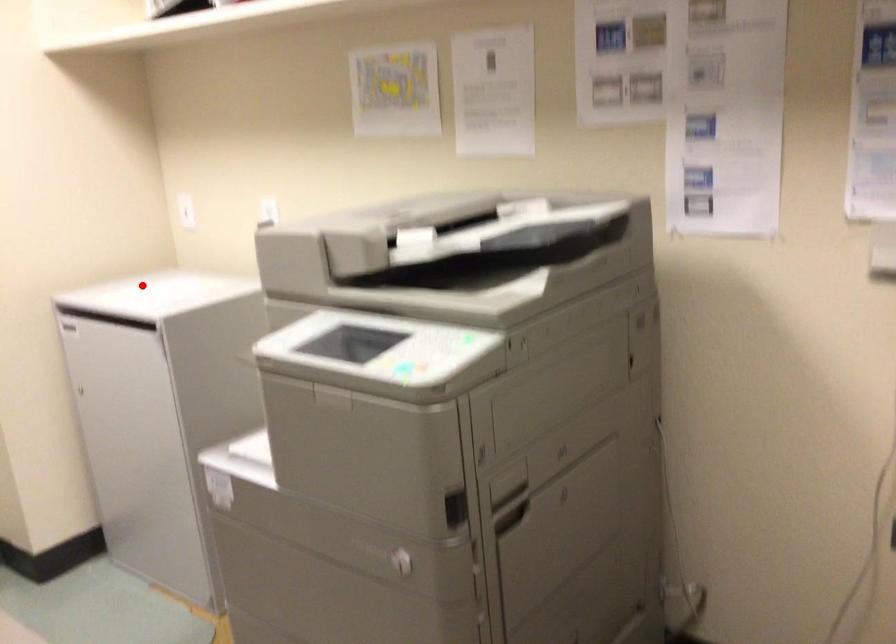
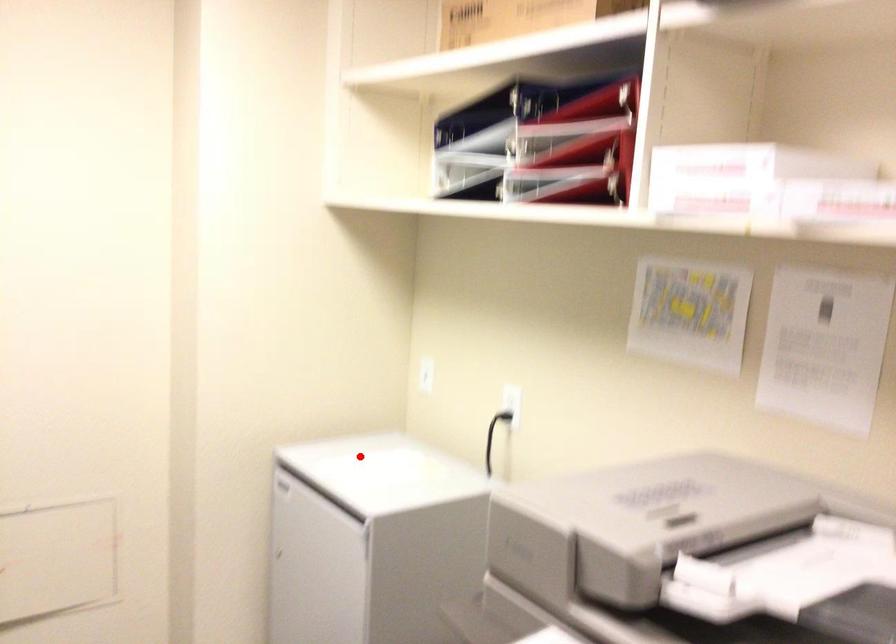
I am providing you with two images of the same scene from different viewpoints. A red point is marked on the first image and another point is marked on the second image. Is the marked point in image1 the same physical position as the marked point in image2?

Yes